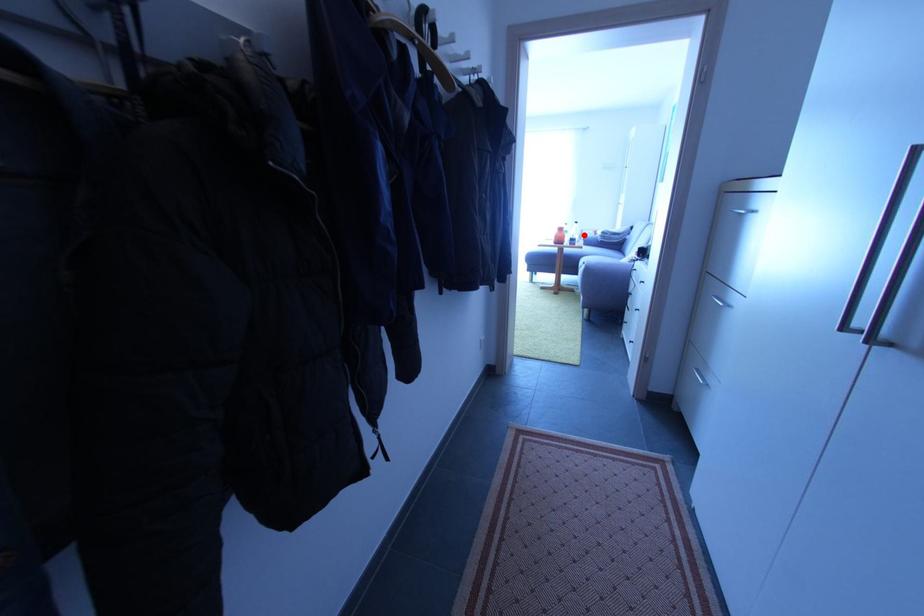
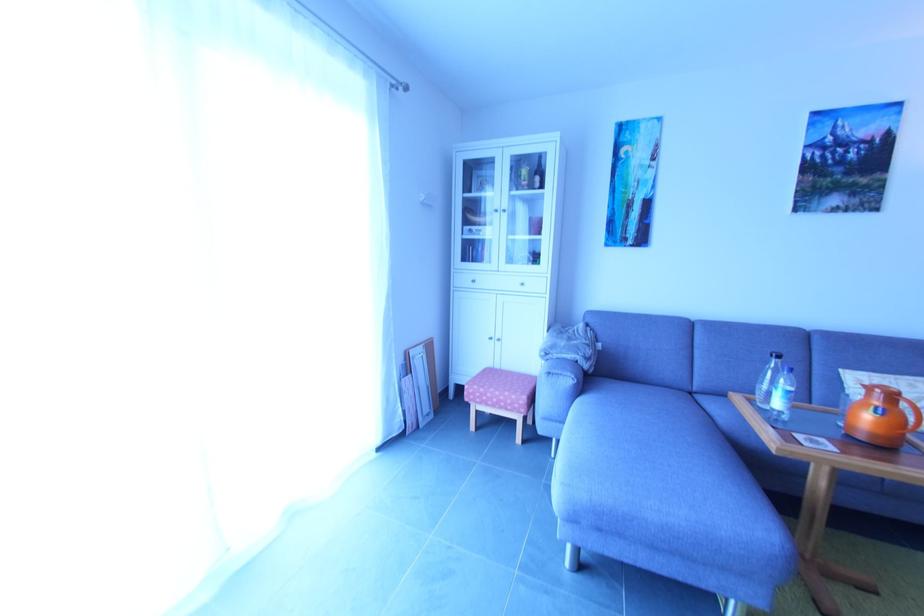
Find the pixel in the second image that matches the highlighted location in the first image.

(406, 362)